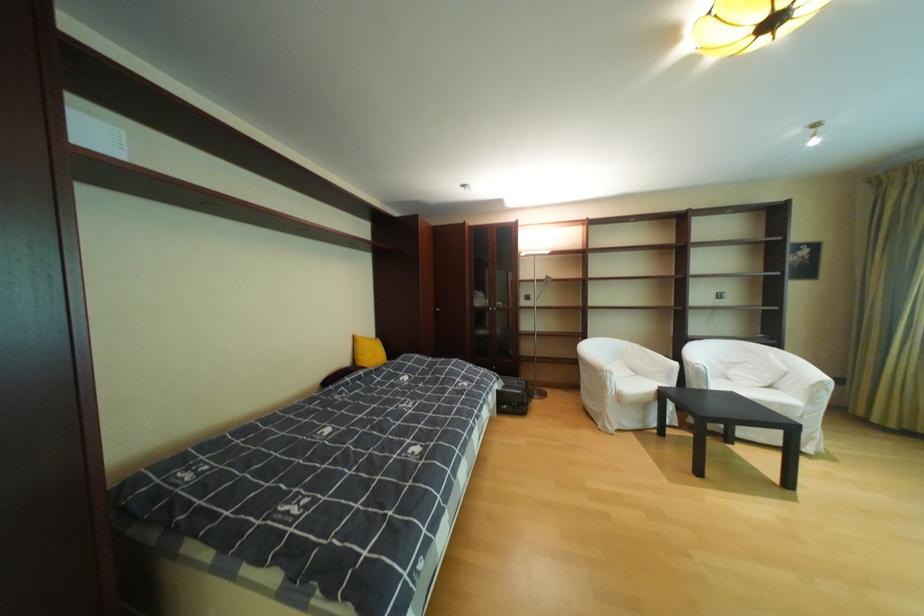
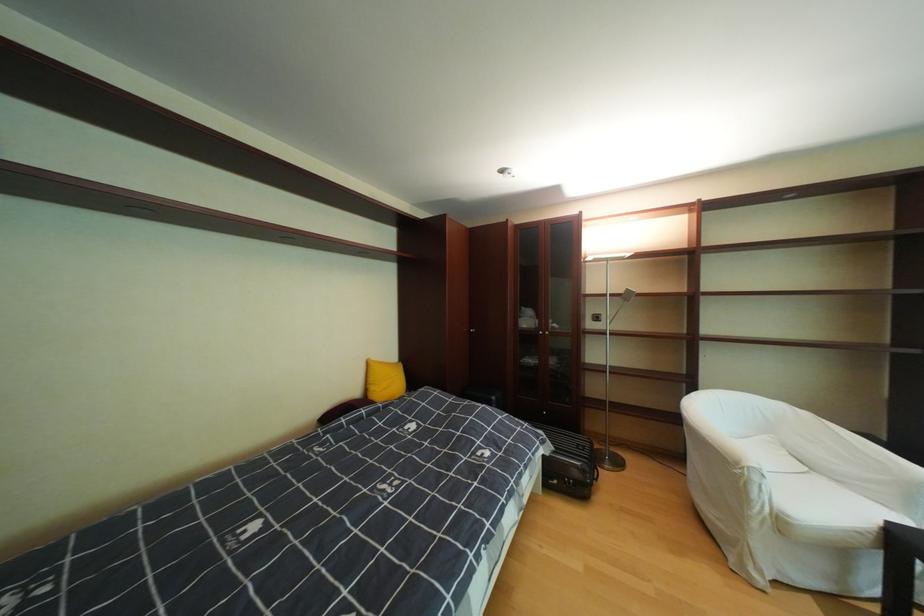
The point at (367, 339) is marked in the first image. Where is the corresponding point in the second image?

(380, 363)